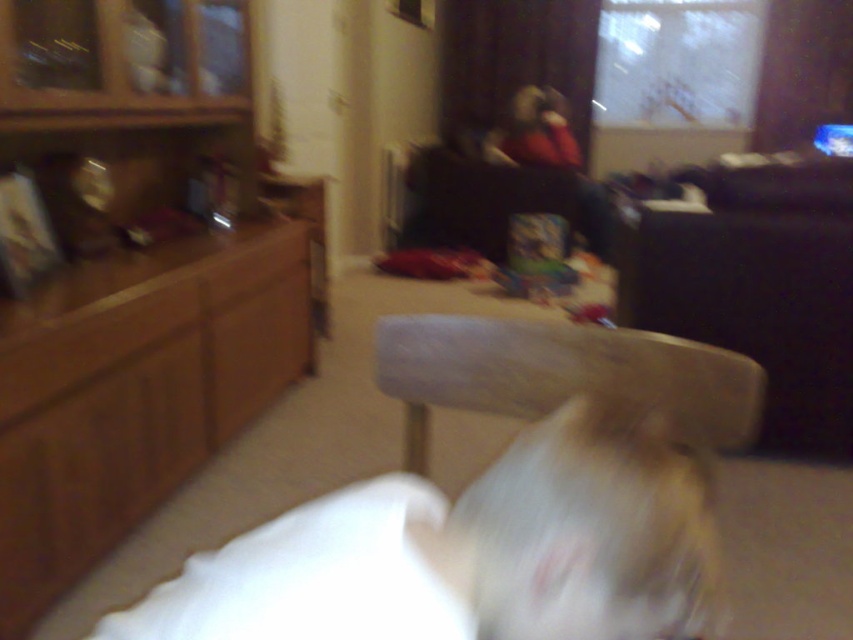
Question: Which is farther from the brown wood dresser at left?

Choices:
 (A) black fabric couch at upper right
 (B) white fur dog at lower center

Answer: (B)

Question: Is black fabric couch at upper right positioned at the back of wooden stool at center?

Choices:
 (A) no
 (B) yes

Answer: (B)

Question: Which object is closer to the camera taking this photo?

Choices:
 (A) black fabric couch at upper right
 (B) wooden stool at center
 (C) white fabric pillow at lower center

Answer: (C)

Question: Considering the real-world distances, which object is closest to the brown wood dresser at left?

Choices:
 (A) black fabric couch at upper right
 (B) white fur dog at lower center
 (C) white fabric pillow at lower center
 (D) wooden stool at center

Answer: (D)

Question: Does brown wood dresser at left appear over wooden stool at center?

Choices:
 (A) yes
 (B) no

Answer: (A)

Question: Can you confirm if black fabric couch at upper right is wider than wooden stool at center?

Choices:
 (A) yes
 (B) no

Answer: (A)